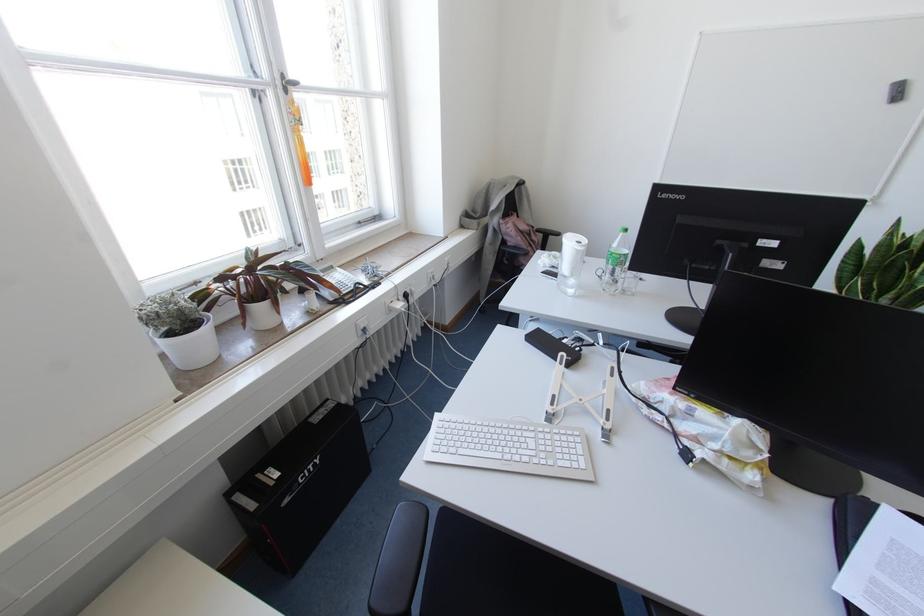
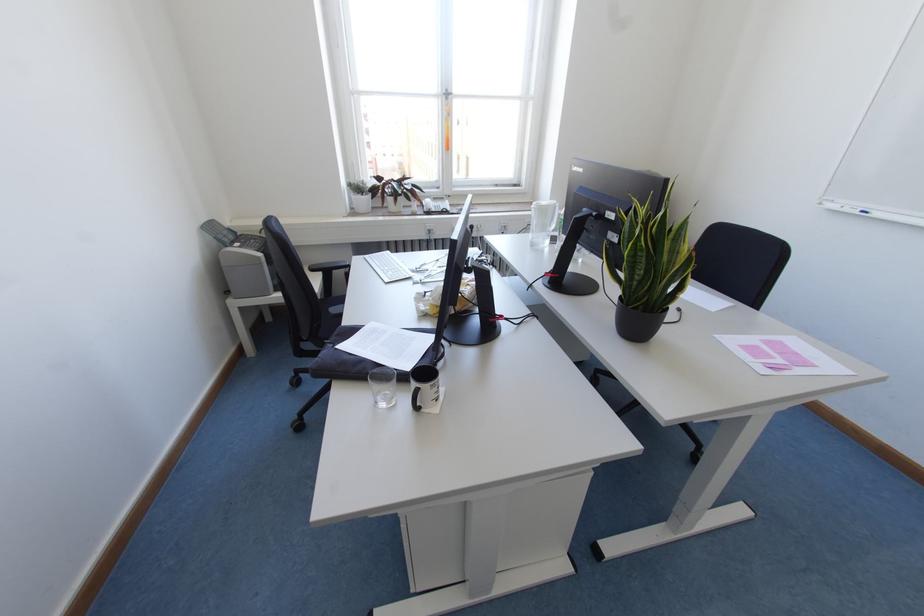
The point at (435, 414) is marked in the first image. Where is the corresponding point in the second image?

(387, 251)